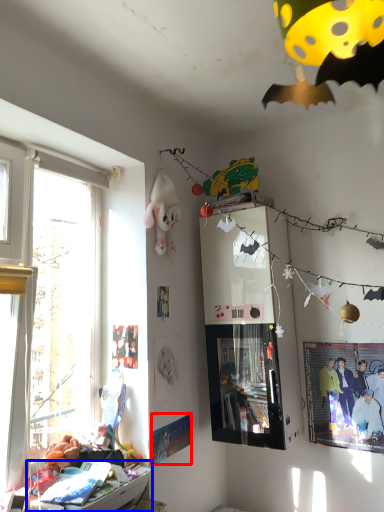
Question: Which object is further to the camera taking this photo, poster page (highlighted by a red box) or furniture (highlighted by a blue box)?

Choices:
 (A) poster page
 (B) furniture

Answer: (A)